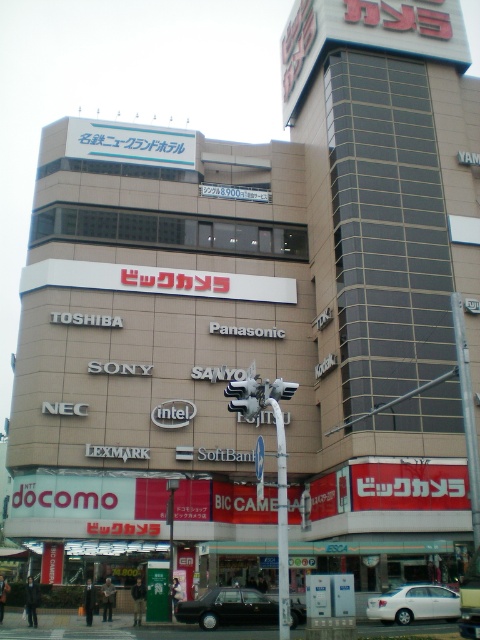
Question: Which point is farther to the camera?

Choices:
 (A) (457, 600)
 (B) (213, 600)

Answer: (A)

Question: Does black glossy car at center have a larger size compared to white matte car at lower center?

Choices:
 (A) no
 (B) yes

Answer: (B)

Question: Can you confirm if black glossy car at center is positioned to the right of white matte car at lower center?

Choices:
 (A) no
 (B) yes

Answer: (A)

Question: Does black glossy car at center appear on the right side of white matte car at lower center?

Choices:
 (A) yes
 (B) no

Answer: (B)

Question: Which object is closer to the camera taking this photo?

Choices:
 (A) white matte car at lower center
 (B) black glossy car at center

Answer: (B)